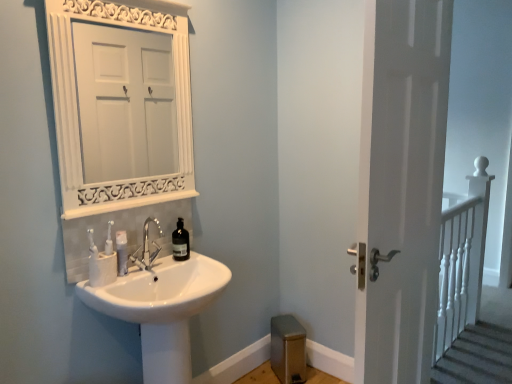
Question: Looking at their shapes, would you say white matte door at right is wider or thinner than white glossy sink at lower left?

Choices:
 (A) wide
 (B) thin

Answer: (B)

Question: From a real-world perspective, relative to white glossy sink at lower left, is white matte door at right vertically above or below?

Choices:
 (A) above
 (B) below

Answer: (A)

Question: Estimate the real-world distances between objects in this image. Which object is closer to the white glossy sink at lower left?

Choices:
 (A) translucent glass bottle at sink
 (B) polished chrome faucet at sink center
 (C) white wooden railing at right
 (D) white matte door at right
 (E) white matte toothpaste tube at sink

Answer: (B)

Question: Considering the real-world distances, which object is closest to the white glossy sink at lower left?

Choices:
 (A) white wooden railing at right
 (B) white matte door at right
 (C) polished chrome faucet at sink center
 (D) white matte toothpaste tube at sink
 (E) translucent glass bottle at sink

Answer: (C)